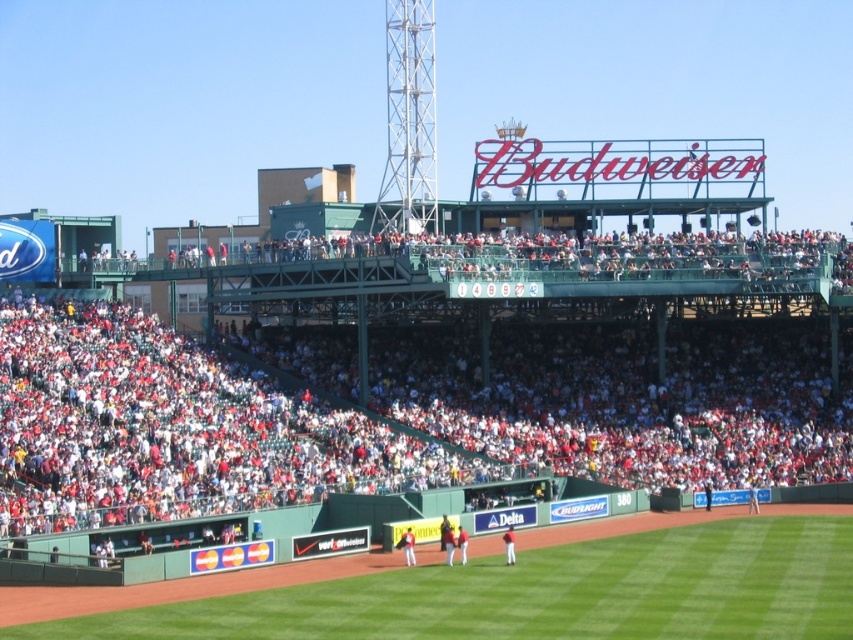
Question: Observing the image, what is the correct spatial positioning of orange jersey at center in reference to white jersey at center?

Choices:
 (A) right
 (B) left

Answer: (B)

Question: Which object is farther from the camera taking this photo?

Choices:
 (A) red uniformed players at center
 (B) dark blue uniform at center
 (C) red baseball uniform at center
 (D) red jersey at center

Answer: (B)

Question: Which object is the farthest from the red uniformed players at center?

Choices:
 (A) white jersey at center
 (B) dark blue uniform at center

Answer: (B)

Question: Which point is closer to the camera taking this photo?

Choices:
 (A) (403, 545)
 (B) (236, 502)
 (C) (312, 612)
 (D) (445, 538)

Answer: (C)

Question: Does orange jersey at center appear over red jersey at center?

Choices:
 (A) yes
 (B) no

Answer: (B)

Question: Does orange jersey at center have a smaller size compared to white jersey at center?

Choices:
 (A) no
 (B) yes

Answer: (B)